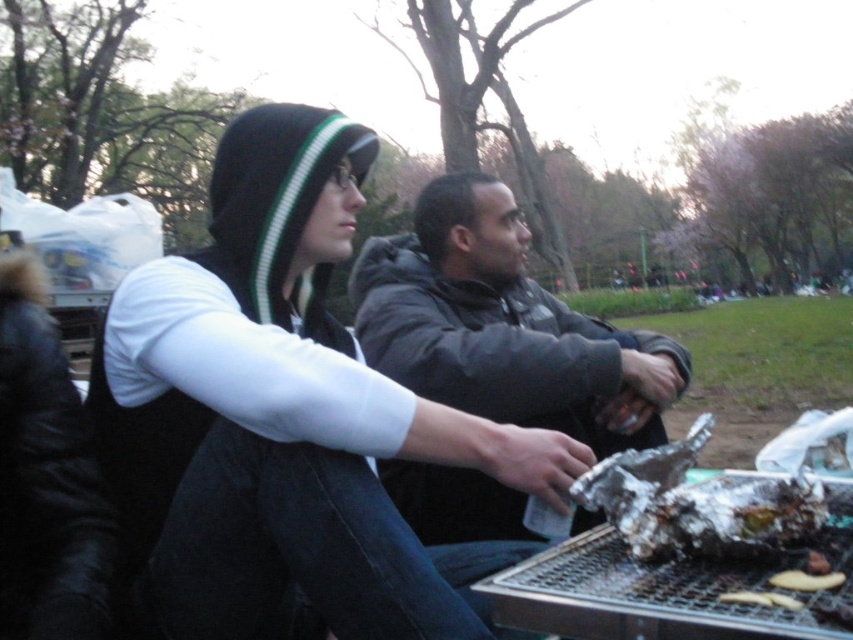
Based on the photo, who is positioned more to the left, brown crispy bread at lower right or golden brown crispy bread at lower right?

Positioned to the left is golden brown crispy bread at lower right.

Between point (775, 579) and point (788, 596), which one is positioned behind?

The point (775, 579) is more distant.

Find the location of a particular element. The height and width of the screenshot is (640, 853). brown crispy bread at lower right is located at coordinates [805, 580].

Is dark gray jacket at center taller than brown crispy bread at lower right?

Yes, dark gray jacket at center is taller than brown crispy bread at lower right.

Between point (479, 276) and point (778, 582), which one is positioned behind?

The point (479, 276) is behind.

Does point (584, 392) lie in front of point (795, 572)?

No, it is behind (795, 572).

The height and width of the screenshot is (640, 853). Identify the location of dark gray jacket at center. (503, 326).

Does point (364, 278) come closer to viewer compared to point (752, 593)?

That is False.

Is point (556, 310) more distant than point (796, 608)?

Yes, point (556, 310) is farther from viewer.

Is point (585, 396) more distant than point (727, 593)?

That is True.

The image size is (853, 640). I want to click on dark gray jacket at center, so point(503,326).